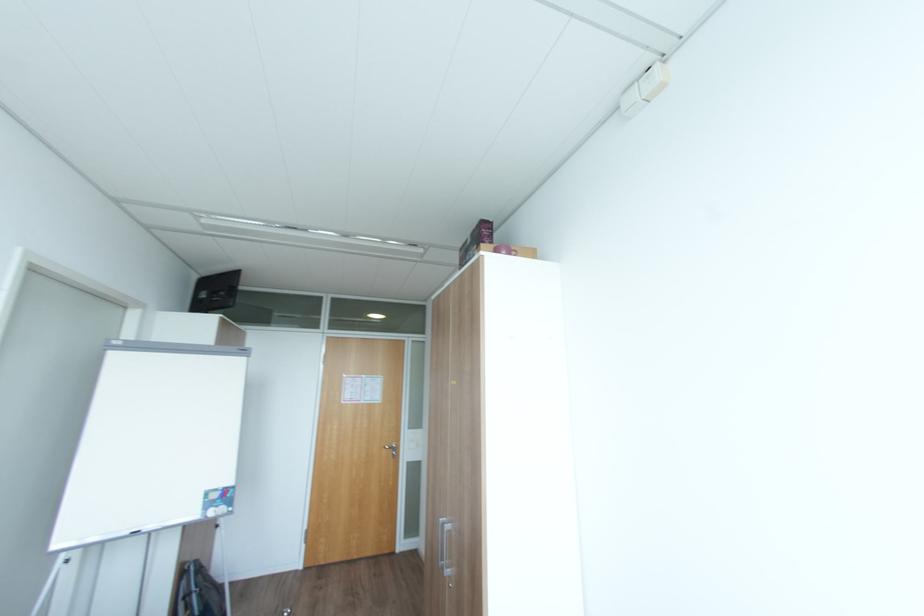
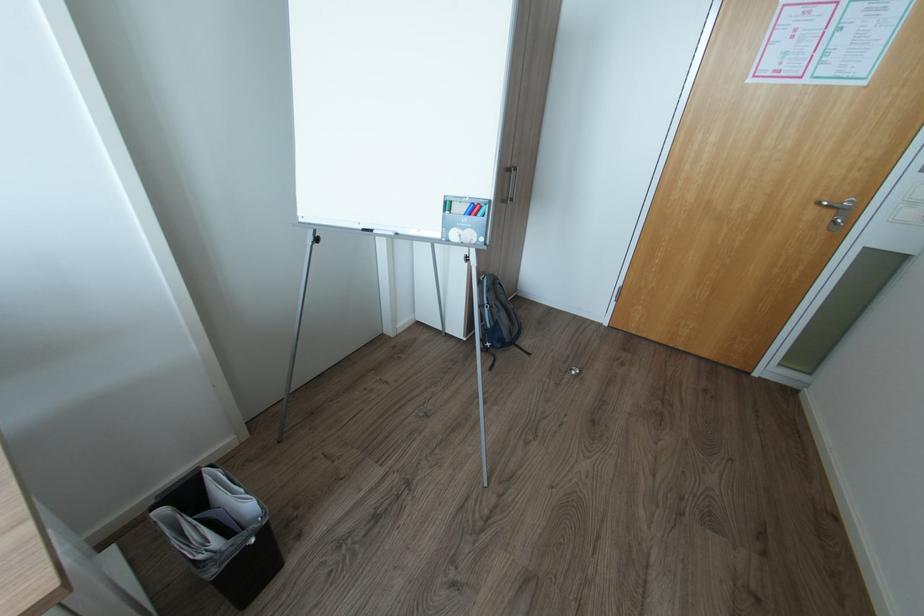
The point at (399, 454) is marked in the first image. Where is the corresponding point in the second image?

(845, 221)